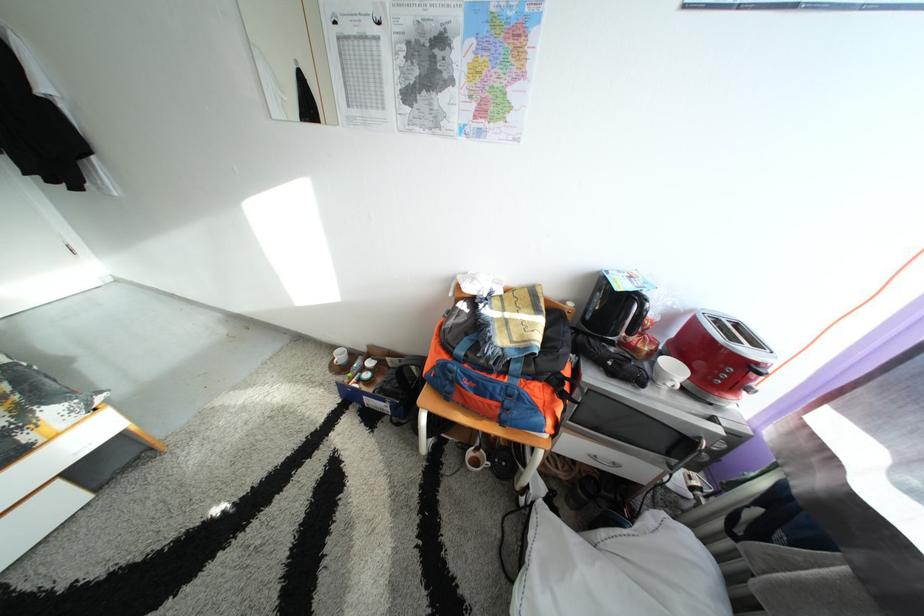
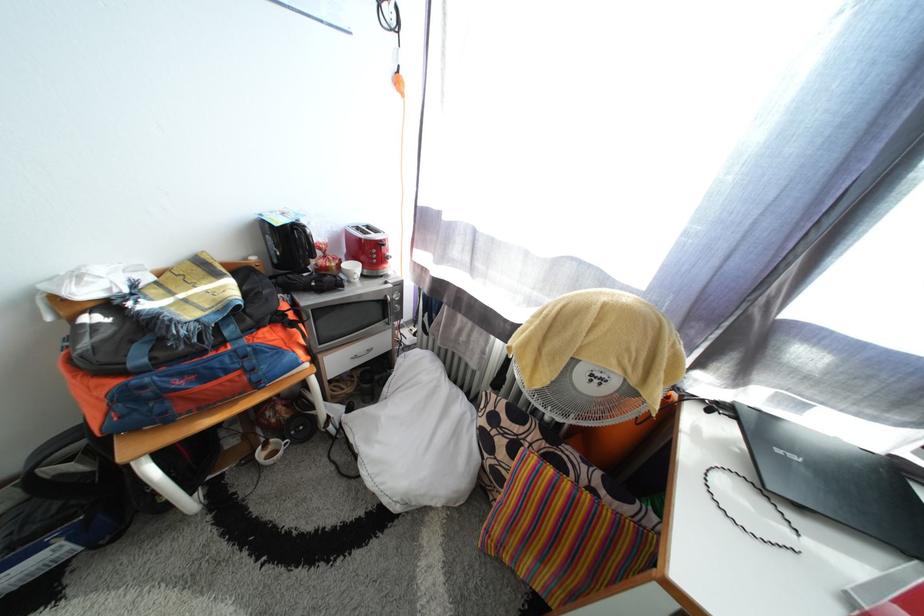
The point at (x=727, y=436) is marked in the first image. Where is the corresponding point in the second image?

(398, 293)